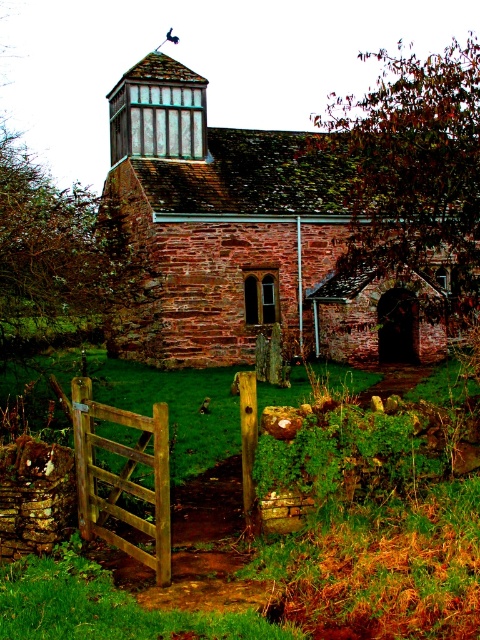
Which is above, brown brick church at center or brown leafy tree at upper right?

brown brick church at center

Measure the distance between brown brick church at center and brown leafy tree at upper right.

They are 1.53 meters apart.

Which is in front, point (159, 64) or point (424, 211)?

Positioned in front is point (424, 211).

Where is `brown brick church at center`? This screenshot has width=480, height=640. brown brick church at center is located at coordinates (295, 218).

Does brown brick church at center have a smaller size compared to wooden gate at lower left?

No, brown brick church at center is not smaller than wooden gate at lower left.

Is point (475, 214) more distant than point (80, 465)?

Yes, point (475, 214) is behind point (80, 465).

This screenshot has height=640, width=480. What are the coordinates of `brown brick church at center` in the screenshot? It's located at coord(295,218).

Which of these two, brown leafy tree at upper right or wooden gate at lower left, stands shorter?

wooden gate at lower left is shorter.

Which is above, brown leafy tree at upper right or wooden gate at lower left?

brown leafy tree at upper right is above.

Between point (346, 349) and point (120, 538), which one is positioned in front?

Point (120, 538)

Identify the location of brown leafy tree at upper right. (410, 193).